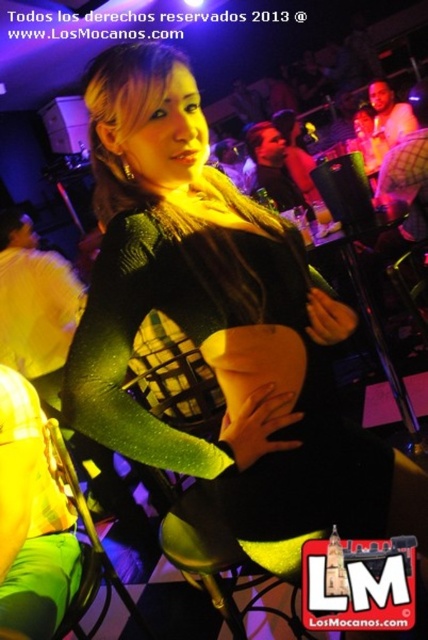
Question: Based on their relative distances, which object is nearer to the green fabric shirt at lower left?

Choices:
 (A) matte black shirt at center
 (B) matte black shirt at upper right
 (C) green sparkly dress at center
 (D) yellow fabric at left

Answer: (C)

Question: Which object appears closest to the camera in this image?

Choices:
 (A) matte black shirt at center
 (B) matte black shirt at upper right
 (C) green sparkly dress at center
 (D) green fabric shirt at lower left

Answer: (C)

Question: Does matte black shirt at center have a greater width compared to matte black shirt at upper right?

Choices:
 (A) yes
 (B) no

Answer: (A)

Question: Which of the following is the farthest from the observer?

Choices:
 (A) (18, 618)
 (B) (401, 125)
 (C) (279, 157)
 (D) (95, 410)

Answer: (B)

Question: Considering the relative positions of green fabric shirt at lower left and matte black shirt at center in the image provided, where is green fabric shirt at lower left located with respect to matte black shirt at center?

Choices:
 (A) left
 (B) right

Answer: (A)

Question: Where is yellow fabric at left located in relation to matte black shirt at center in the image?

Choices:
 (A) above
 (B) below

Answer: (B)